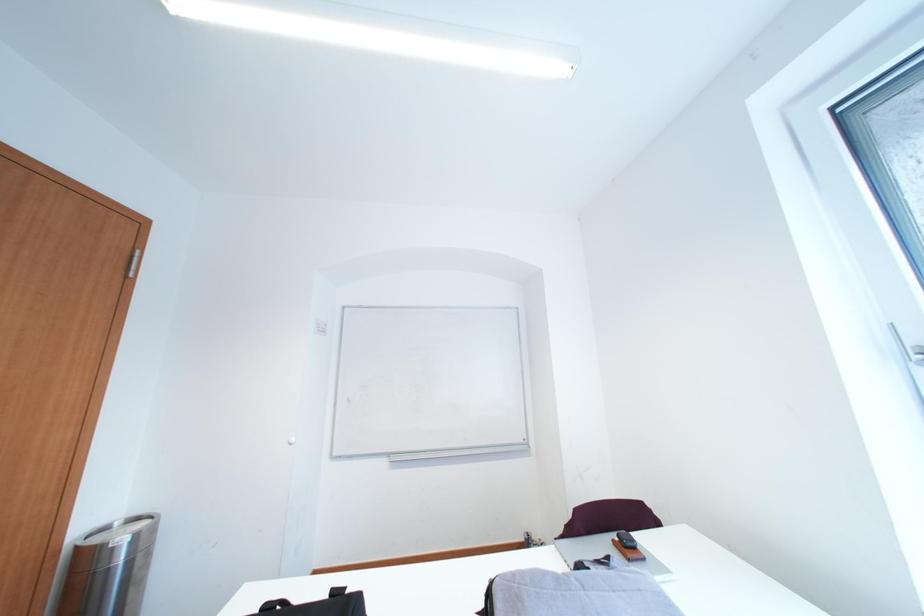
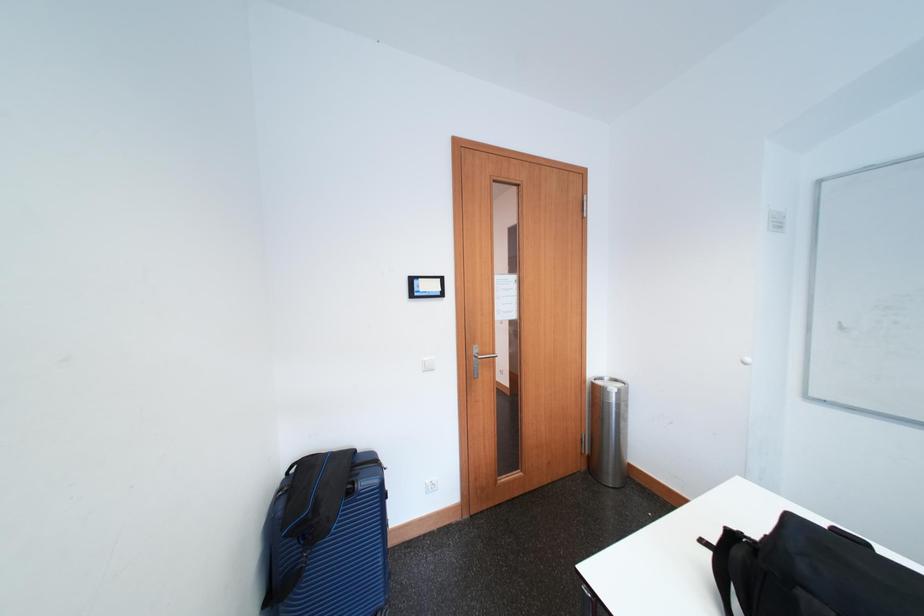
Question: The images are taken continuously from a first-person perspective. In which direction is your viewpoint rotating?

Choices:
 (A) Left
 (B) Right
 (C) Up
 (D) Down

Answer: (A)